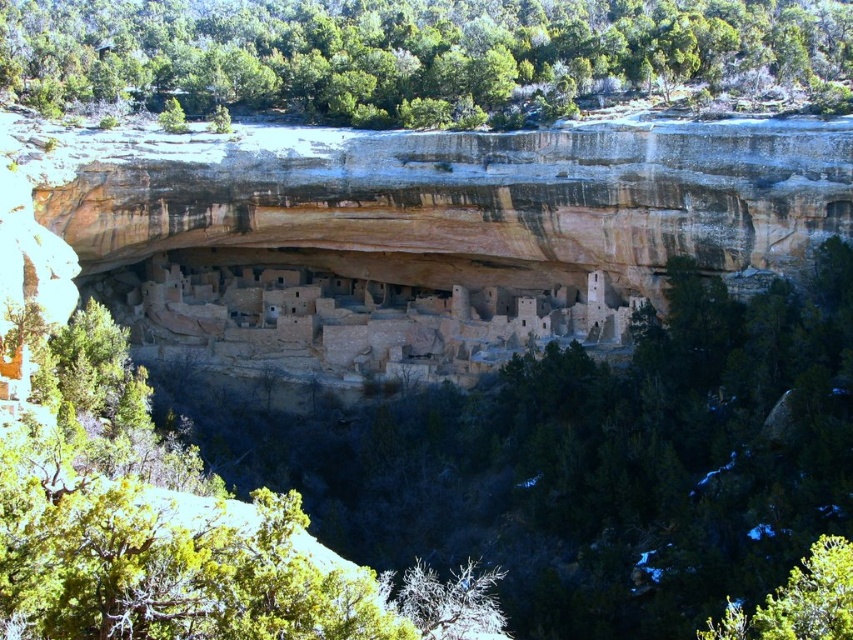
You are a hiker who wants to take a photo of the cliffside dwelling. You notice two green leafy trees in the scene. Which tree would block your view of the dwelling if you stand behind it? Please choose between the green leafy tree at upper center and the green leafy tree at lower right.

The green leafy tree at upper center is larger in size than the green leafy tree at lower right, so standing behind the green leafy tree at upper center would block your view of the cliffside dwelling more than the other tree.

You are standing at the base of the cliff looking up at the cliffside dwelling. There are two points marked on the cliff face, one at coordinates point (682, 49) and the other at point (785, 598). Which point is closer to your eyes?

Point (682, 49) is further to the camera than point (785, 598). Wait, the question asks which is closer to your eyes. Since point (682, 49) is further away, the closer one would be point (785, 598). Therefore, the answer is point (785, 598).

You are a hiker trying to navigate through the cliffside area. You see two landmarks, the green leafy tree at upper center and the green leafy tree at lower right. Which tree is positioned more to the left side of your view?

The green leafy tree at upper center is positioned more to the left side of your view compared to the green leafy tree at lower right.